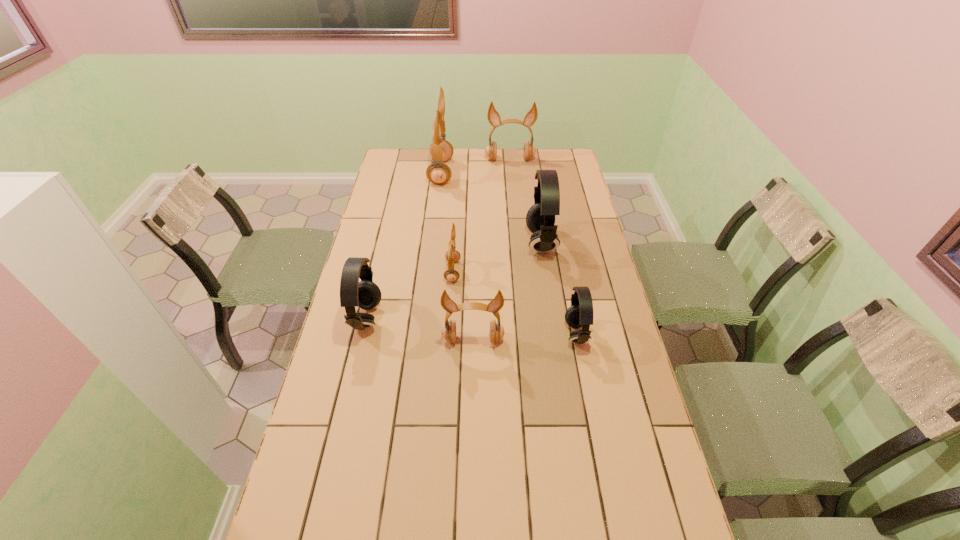
Find the location of a particular element. the biggest brown earphone is located at coordinates (441, 150).

The width and height of the screenshot is (960, 540). I want to click on the tallest earphone, so click(441, 150).

Locate an element on the screen. This screenshot has height=540, width=960. the third smallest brown earphone is located at coordinates (493, 116).

Identify the location of the farthest black earphone. (540, 219).

Locate an element on the screen. the nearest brown earphone is located at coordinates (448, 332).

At what (x,y) coordinates should I click in order to perform the action: click on the second biggest black earphone. Please return your answer as a coordinate pair (x, y). The height and width of the screenshot is (540, 960). Looking at the image, I should click on (365, 294).

Where is `the leftmost object`? The width and height of the screenshot is (960, 540). the leftmost object is located at coordinates (365, 294).

I want to click on the smallest brown earphone, so click(452, 256).

At what (x,y) coordinates should I click in order to perform the action: click on the smallest black earphone. Please return your answer as a coordinate pair (x, y). Looking at the image, I should click on (580, 314).

Locate an element on the screen. This screenshot has width=960, height=540. vacant space located on the front-facing side of the tallest object is located at coordinates (466, 172).